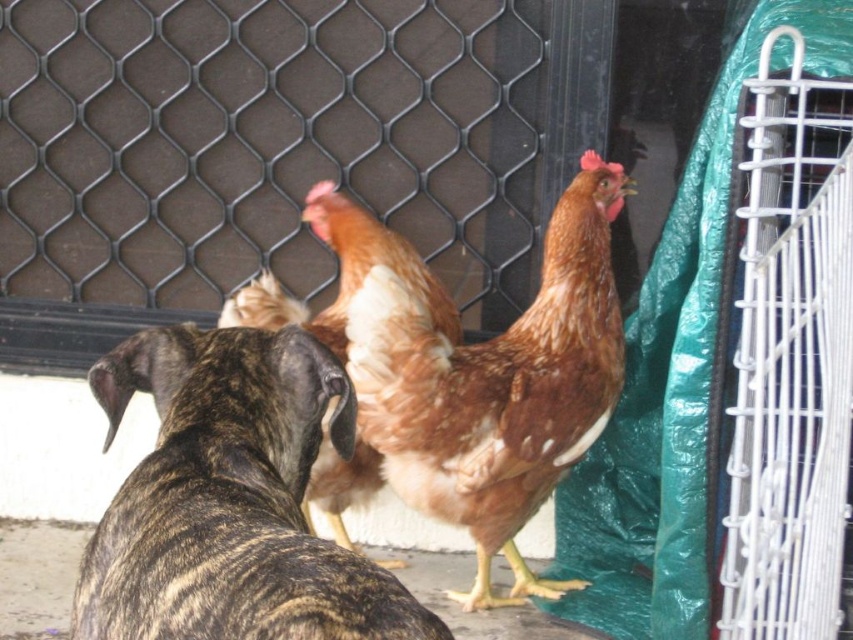
Question: Which point appears farthest from the camera in this image?

Choices:
 (A) (473, 516)
 (B) (421, 627)

Answer: (A)

Question: Where is brindle fur dog at center located in relation to brown feathered chicken at center in the image?

Choices:
 (A) right
 (B) left

Answer: (B)

Question: Can you confirm if brindle fur dog at center is bigger than brown feathered chicken at center?

Choices:
 (A) no
 (B) yes

Answer: (A)

Question: Among these points, which one is farthest from the camera?

Choices:
 (A) (521, 506)
 (B) (206, 477)

Answer: (A)

Question: Is the position of brindle fur dog at center more distant than that of brown feathered chicken at center?

Choices:
 (A) no
 (B) yes

Answer: (A)